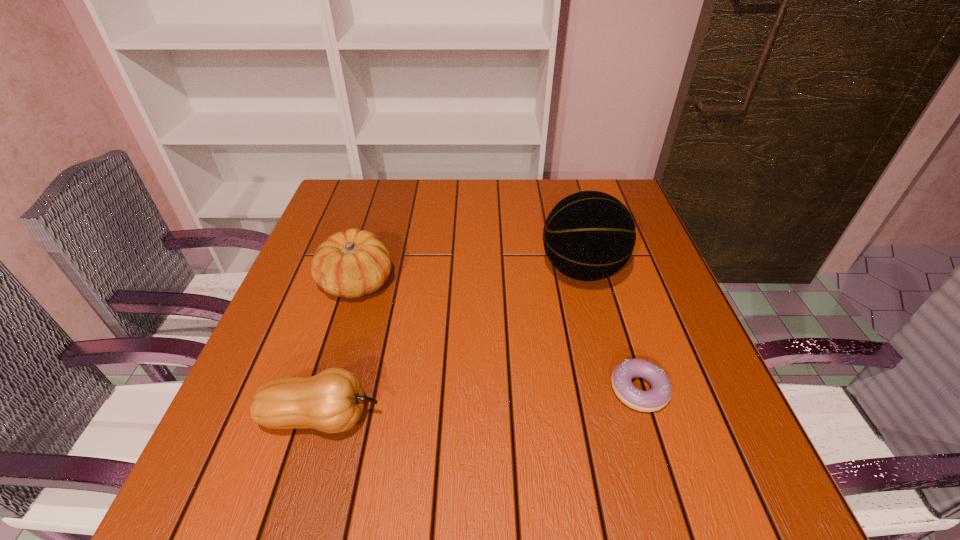
In the image, there is a desktop. Identify the location of free space at the far edge. The height and width of the screenshot is (540, 960). (532, 217).

This screenshot has width=960, height=540. I want to click on free space at the near edge of the desktop, so click(320, 508).

This screenshot has height=540, width=960. In the image, there is a desktop. What are the coordinates of `vacant space at the left edge` in the screenshot? It's located at (308, 296).

This screenshot has height=540, width=960. What are the coordinates of `free location at the right edge` in the screenshot? It's located at (671, 400).

At what (x,y) coordinates should I click in order to perform the action: click on vacant space in between the shortest object and the basketball. Please return your answer as a coordinate pair (x, y). This screenshot has width=960, height=540. Looking at the image, I should click on (611, 330).

The image size is (960, 540). Find the location of `vacant space in between the shortest object and the farther gourd`. vacant space in between the shortest object and the farther gourd is located at coordinates (498, 335).

This screenshot has height=540, width=960. I want to click on empty location between the nearer gourd and the basketball, so click(x=452, y=344).

The height and width of the screenshot is (540, 960). Find the location of `free space between the farther gourd and the doughnut`. free space between the farther gourd and the doughnut is located at coordinates (498, 335).

Image resolution: width=960 pixels, height=540 pixels. In order to click on vacant area that lies between the nearer gourd and the basketball in this screenshot , I will do `click(452, 344)`.

Image resolution: width=960 pixels, height=540 pixels. In order to click on free point between the farther gourd and the nearer gourd in this screenshot , I will do `click(340, 349)`.